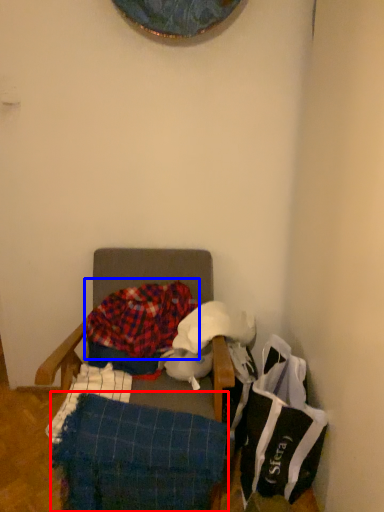
Question: Which of the following is the farthest to the observer, blanket (highlighted by a red box) or blanket (highlighted by a blue box)?

Choices:
 (A) blanket
 (B) blanket

Answer: (B)